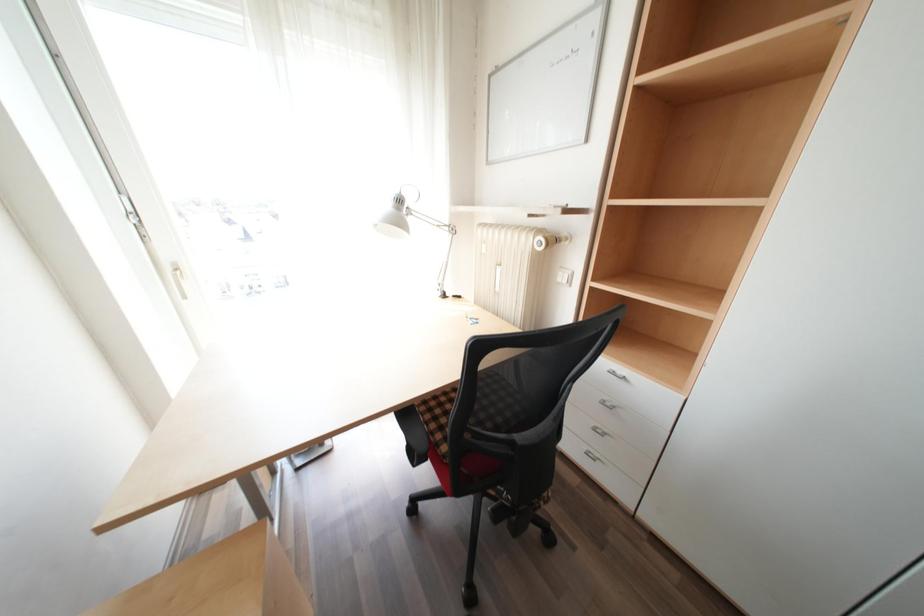
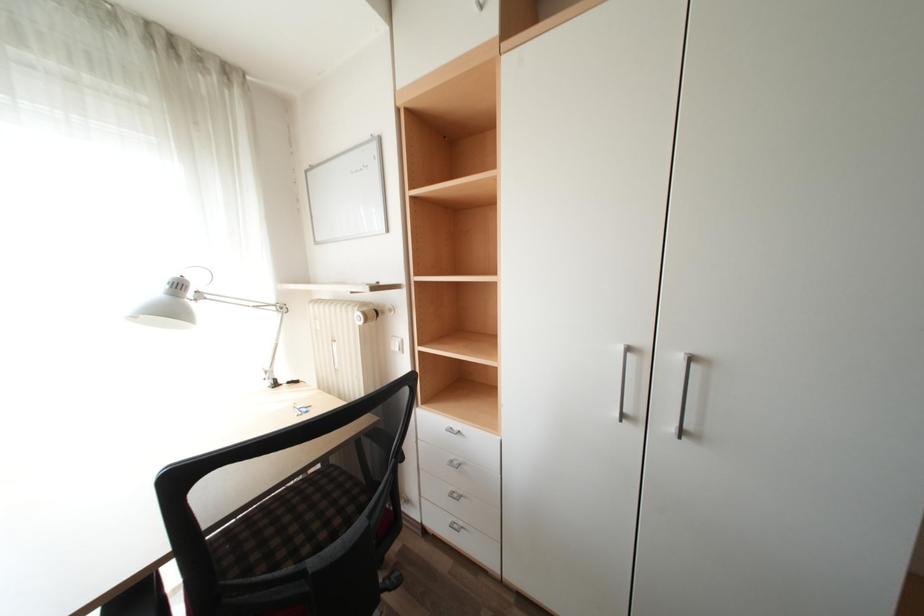
Question: What movement of the cameraman would produce the second image?

Choices:
 (A) Left
 (B) Right
 (C) Forward
 (D) Backward

Answer: (B)